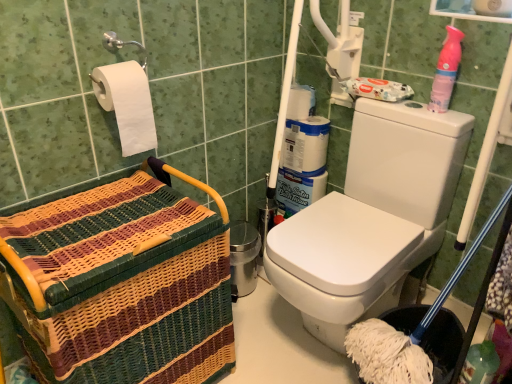
Question: Is white matte toilet paper at upper left positioned with its back to woven wood basket at left?

Choices:
 (A) yes
 (B) no

Answer: (B)

Question: Considering the relative sizes of white matte toilet paper at upper left and woven wood basket at left in the image provided, is white matte toilet paper at upper left smaller than woven wood basket at left?

Choices:
 (A) yes
 (B) no

Answer: (A)

Question: Is white matte toilet paper at upper left located outside woven wood basket at left?

Choices:
 (A) yes
 (B) no

Answer: (A)

Question: Can you see white matte toilet paper at upper left touching woven wood basket at left?

Choices:
 (A) no
 (B) yes

Answer: (A)

Question: From a real-world perspective, is white matte toilet paper at upper left over woven wood basket at left?

Choices:
 (A) yes
 (B) no

Answer: (A)

Question: Considering the relative positions of white matte toilet paper at upper left and woven wood basket at left in the image provided, is white matte toilet paper at upper left in front of woven wood basket at left?

Choices:
 (A) yes
 (B) no

Answer: (B)

Question: Considering the relative sizes of pink plastic spray bottle at upper right and woven wood basket at left in the image provided, is pink plastic spray bottle at upper right shorter than woven wood basket at left?

Choices:
 (A) yes
 (B) no

Answer: (A)

Question: Considering the relative sizes of pink plastic spray bottle at upper right and woven wood basket at left in the image provided, is pink plastic spray bottle at upper right thinner than woven wood basket at left?

Choices:
 (A) no
 (B) yes

Answer: (B)

Question: Can you confirm if pink plastic spray bottle at upper right is smaller than woven wood basket at left?

Choices:
 (A) yes
 (B) no

Answer: (A)

Question: Is pink plastic spray bottle at upper right in contact with woven wood basket at left?

Choices:
 (A) no
 (B) yes

Answer: (A)

Question: Is pink plastic spray bottle at upper right wider than woven wood basket at left?

Choices:
 (A) no
 (B) yes

Answer: (A)

Question: Are pink plastic spray bottle at upper right and woven wood basket at left located far from each other?

Choices:
 (A) no
 (B) yes

Answer: (A)

Question: Can you confirm if white matte toilet paper at upper left is shorter than pink plastic spray bottle at upper right?

Choices:
 (A) no
 (B) yes

Answer: (A)